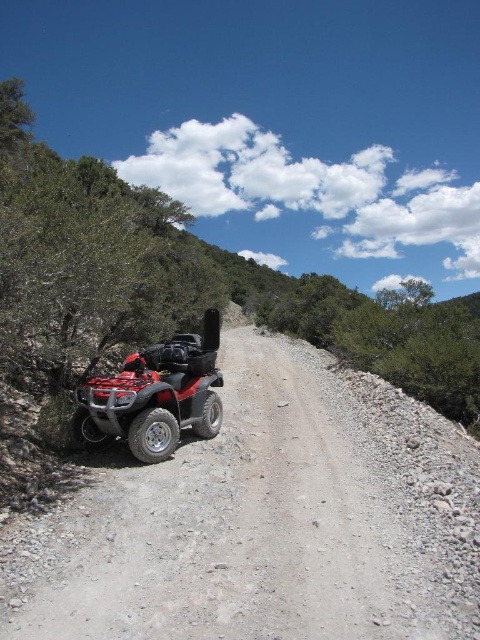
You are a hiker who has just arrived at the trailhead and notice the red matte quad bike at left and the dirt gravel at left. Which object is located below the other?

The dirt gravel at left is positioned under the red matte quad bike at left, so the dirt gravel is below the quad bike.

You are navigating an offroad trail on a red and black four wheeler. You see a point at coordinates (264,520). What type of terrain is located at this point?

The dirt gravel at left is located at point (264,520).

You are navigating an offroad trail on the red and black four wheeler parked on the side of the dirt trail. You see two points marked on your GPS. The first point is at point (368, 534) and the second point is at point (157, 397). Which point should you head towards first to stay on the safest path?

You should head towards point (368, 534) first because it is in front of point (157, 397), meaning it is closer to your current position on the trail and likely part of the safer path.